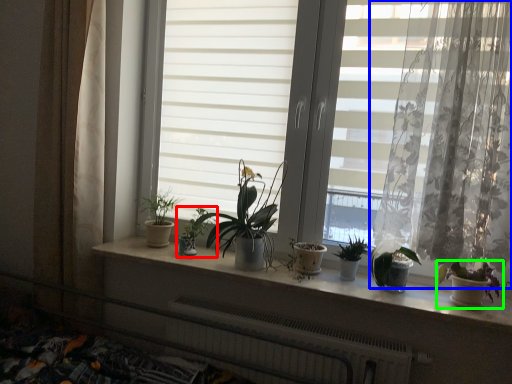
Question: Which is nearer to the houseplant (highlighted by a red box)? curtain (highlighted by a blue box) or houseplant (highlighted by a green box).

Choices:
 (A) curtain
 (B) houseplant

Answer: (A)